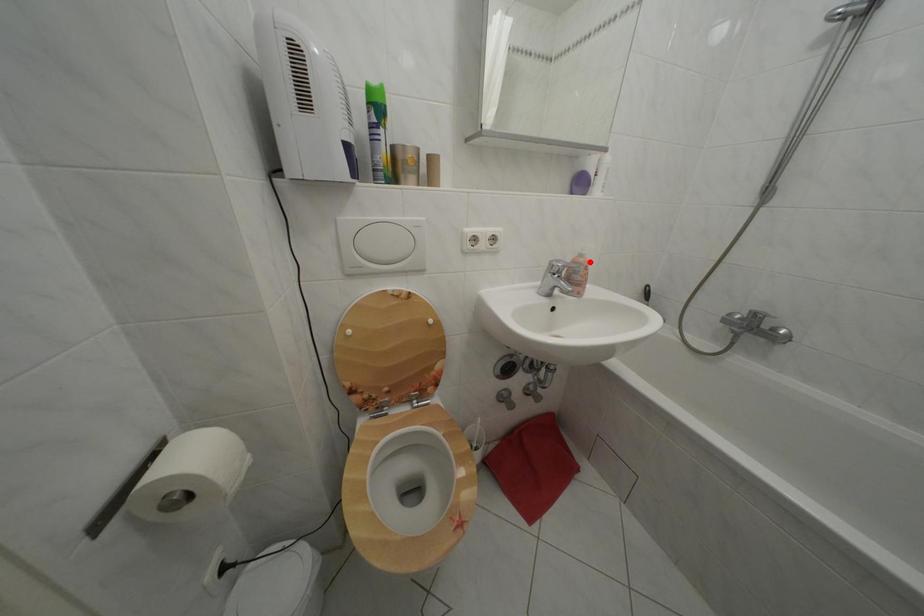
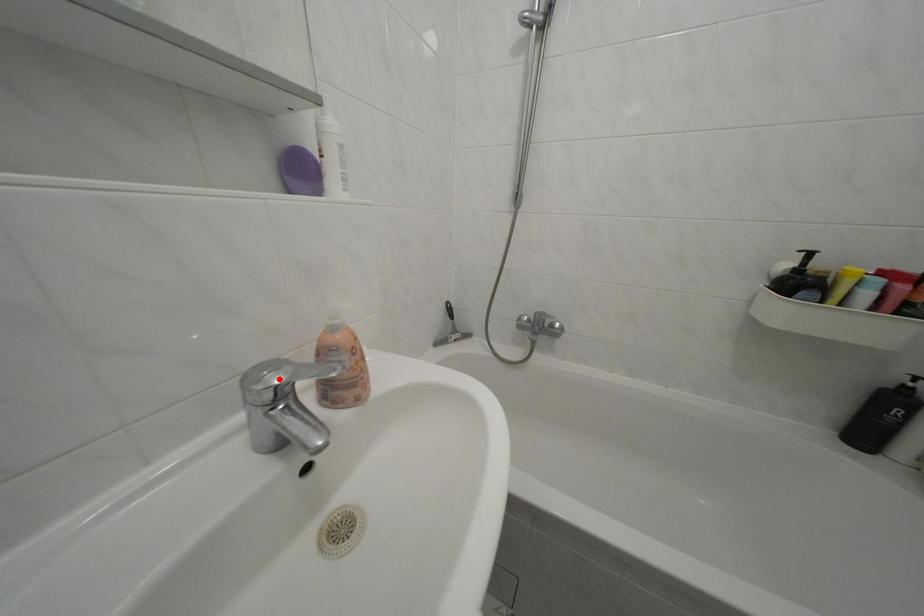
Consider the image. I am providing you with two images of the same scene from different viewpoints. A red point is marked on the first image and another point is marked on the second image. Are the points marked in image1 and image2 representing the same 3D position?

No